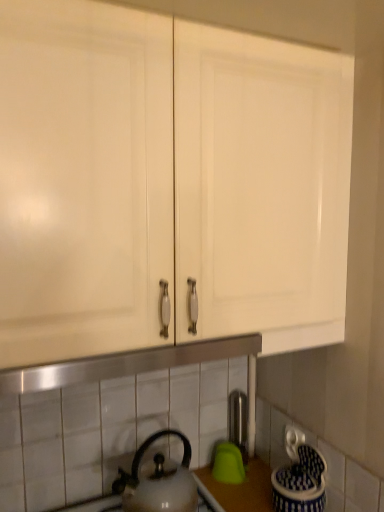
Question: Is white glossy kettle at lower center wider than satin nickel faucet at center?

Choices:
 (A) yes
 (B) no

Answer: (A)

Question: Is white glossy kettle at lower center beside satin nickel faucet at center?

Choices:
 (A) no
 (B) yes

Answer: (A)

Question: Does white glossy kettle at lower center come behind satin nickel faucet at center?

Choices:
 (A) no
 (B) yes

Answer: (A)

Question: Is white glossy kettle at lower center thinner than satin nickel faucet at center?

Choices:
 (A) no
 (B) yes

Answer: (A)

Question: Is white glossy kettle at lower center taller than satin nickel faucet at center?

Choices:
 (A) yes
 (B) no

Answer: (B)

Question: In the image, is satin nickel faucet at center on the left side or the right side of white glossy cabinet doors at upper center?

Choices:
 (A) right
 (B) left

Answer: (A)

Question: From a real-world perspective, is satin nickel faucet at center physically located above or below white glossy cabinet doors at upper center?

Choices:
 (A) above
 (B) below

Answer: (B)

Question: Based on their sizes in the image, would you say satin nickel faucet at center is bigger or smaller than white glossy cabinet doors at upper center?

Choices:
 (A) small
 (B) big

Answer: (A)

Question: Looking at their shapes, would you say satin nickel faucet at center is wider or thinner than white glossy cabinet doors at upper center?

Choices:
 (A) wide
 (B) thin

Answer: (B)

Question: Is satin nickel faucet at center inside the boundaries of white glossy kettle at lower center, or outside?

Choices:
 (A) outside
 (B) inside

Answer: (A)

Question: In the image, is satin nickel faucet at center on the left side or the right side of white glossy kettle at lower center?

Choices:
 (A) left
 (B) right

Answer: (B)

Question: From the image's perspective, is satin nickel faucet at center positioned above or below white glossy kettle at lower center?

Choices:
 (A) below
 (B) above

Answer: (B)

Question: Considering the positions of satin nickel faucet at center and white glossy kettle at lower center in the image, is satin nickel faucet at center bigger or smaller than white glossy kettle at lower center?

Choices:
 (A) big
 (B) small

Answer: (B)

Question: Is white glossy cabinet doors at upper center wider or thinner than white glossy kettle at lower center?

Choices:
 (A) wide
 (B) thin

Answer: (A)

Question: From the image's perspective, relative to white glossy kettle at lower center, is white glossy cabinet doors at upper center above or below?

Choices:
 (A) below
 (B) above

Answer: (B)